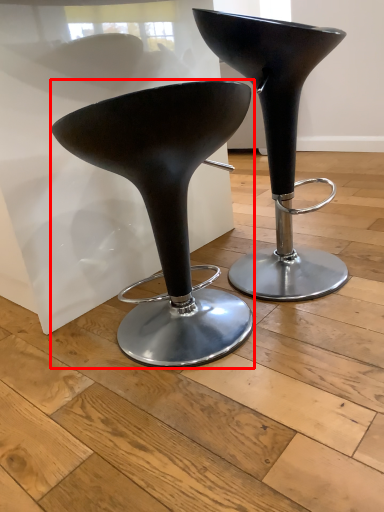
Question: From the image's perspective, where is stool (annotated by the red box) located in relation to stool in the image?

Choices:
 (A) above
 (B) below

Answer: (B)